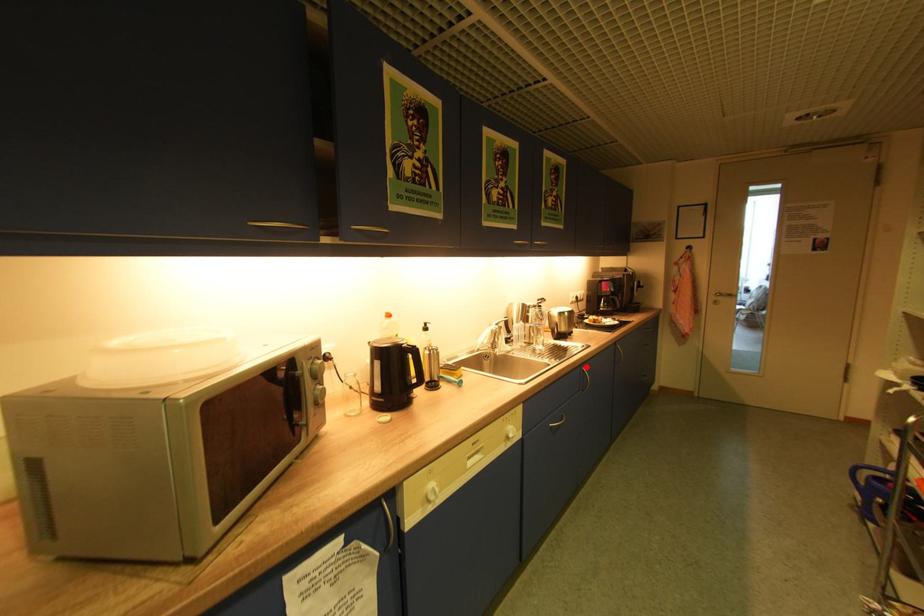
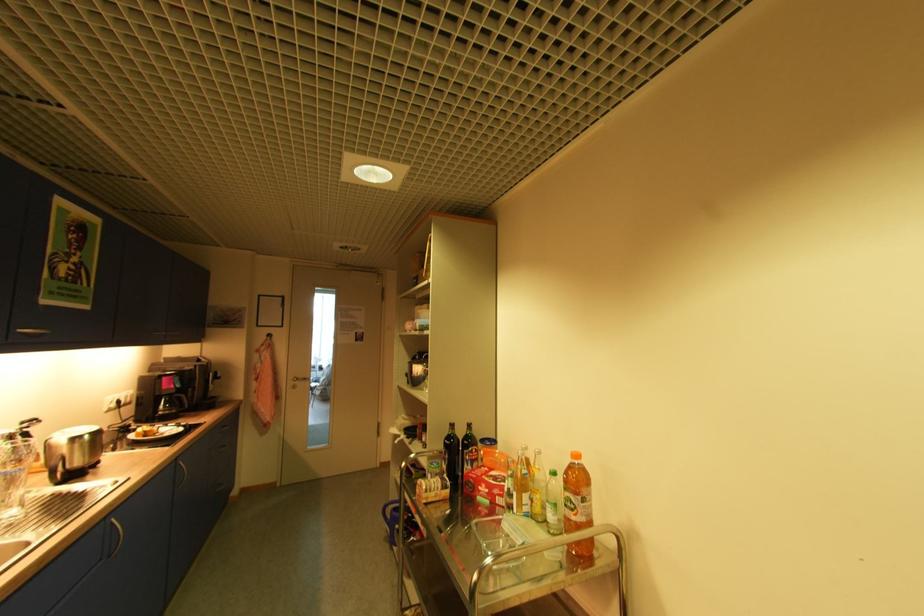
Where in the second image is the point corresponding to the highlighted location from the first image?

(111, 517)